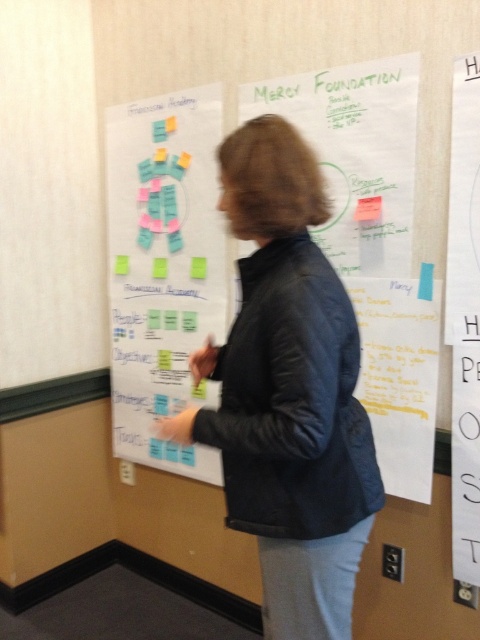
You are an interior designer assessing the layout of this room. The dark blue leather jacket at center and the white paper at upper right are both in view. Which object is taller?

The white paper at upper right is taller than the dark blue leather jacket at center.